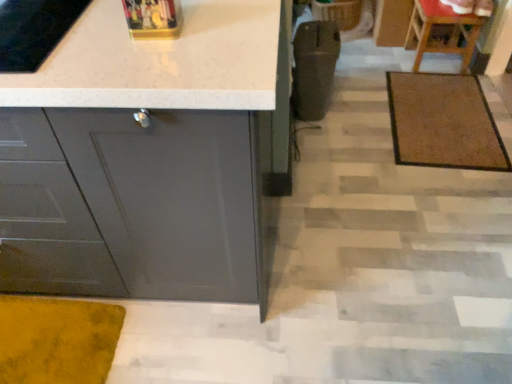
I want to click on brown textured mat at center right, so click(443, 122).

From the picture: Is matte gray cabinet at lower left situated inside wooden chair at upper right or outside?

matte gray cabinet at lower left is outside wooden chair at upper right.

From a real-world perspective, which object stands above the other?

In real-world perspective, matte gray cabinet at lower left is above.

From the image's perspective, is matte gray cabinet at lower left positioned above or below wooden chair at upper right?

Based on their image positions, matte gray cabinet at lower left is located beneath wooden chair at upper right.

Measure the distance between matte gray cabinet at lower left and wooden chair at upper right.

matte gray cabinet at lower left and wooden chair at upper right are 5.77 feet apart from each other.

From the image's perspective, between wooden chair at upper right and matte gray cabinet at lower left, which one is located above?

wooden chair at upper right, from the image's perspective.

From a real-world perspective, which is physically above, wooden chair at upper right or matte gray cabinet at lower left?

matte gray cabinet at lower left.

Is point (411, 23) positioned behind point (45, 171)?

Yes, point (411, 23) is behind point (45, 171).

Which is in front, point (444, 109) or point (428, 39)?

The point (444, 109) is more forward.

Can wooden chair at upper right be found inside brown textured mat at center right?

No, brown textured mat at center right does not contain wooden chair at upper right.

Is brown textured mat at center right taller or shorter than wooden chair at upper right?

Considering their sizes, brown textured mat at center right has less height than wooden chair at upper right.

From the image's perspective, which is above, brown textured mat at center right or wooden chair at upper right?

wooden chair at upper right, from the image's perspective.

Can you confirm if matte gray cabinet at lower left is wider than brown textured mat at center right?

In fact, matte gray cabinet at lower left might be narrower than brown textured mat at center right.

Based on the photo, is matte gray cabinet at lower left aimed at brown textured mat at center right?

No, matte gray cabinet at lower left is not facing towards brown textured mat at center right.

From a real-world perspective, between matte gray cabinet at lower left and brown textured mat at center right, who is vertically lower?

brown textured mat at center right, from a real-world perspective.

From the image's perspective, which object appears higher, matte gray cabinet at lower left or brown textured mat at center right?

brown textured mat at center right is shown above in the image.

Could you tell me if brown textured mat at center right is facing matte gray cabinet at lower left?

No, brown textured mat at center right is not oriented towards matte gray cabinet at lower left.

Does point (425, 162) come behind point (215, 181)?

Yes.

Between brown textured mat at center right and matte gray cabinet at lower left, which one has larger size?

matte gray cabinet at lower left is bigger.

Can you confirm if wooden chair at upper right is smaller than brown textured mat at center right?

No.

From the image's perspective, which is below, wooden chair at upper right or brown textured mat at center right?

brown textured mat at center right, from the image's perspective.

Can you confirm if wooden chair at upper right is taller than brown textured mat at center right?

Indeed, wooden chair at upper right has a greater height compared to brown textured mat at center right.

Image resolution: width=512 pixels, height=384 pixels. Find the location of `chair above the matte gray cabinet at lower left (from the image's perspective)`. chair above the matte gray cabinet at lower left (from the image's perspective) is located at coordinates (441, 32).

Image resolution: width=512 pixels, height=384 pixels. What are the coordinates of `cabinetry on the left of the wooden chair at upper right` in the screenshot? It's located at (149, 158).

Which object lies nearer to the anchor point matte gray cabinet at lower left, wooden chair at upper right or brown textured mat at center right?

Among the two, brown textured mat at center right is located nearer to matte gray cabinet at lower left.

Consider the image. Which object lies further to the anchor point brown textured mat at center right, wooden chair at upper right or matte gray cabinet at lower left?

Based on the image, matte gray cabinet at lower left appears to be further to brown textured mat at center right.

Based on their spatial positions, is brown textured mat at center right or matte gray cabinet at lower left further from wooden chair at upper right?

matte gray cabinet at lower left is further to wooden chair at upper right.

Estimate the real-world distances between objects in this image. Which object is closer to matte gray cabinet at lower left, brown textured mat at center right or wooden chair at upper right?

brown textured mat at center right is positioned closer to the anchor matte gray cabinet at lower left.

Estimate the real-world distances between objects in this image. Which object is closer to wooden chair at upper right, matte gray cabinet at lower left or brown textured mat at center right?

Based on the image, brown textured mat at center right appears to be nearer to wooden chair at upper right.

Estimate the real-world distances between objects in this image. Which object is closer to brown textured mat at center right, matte gray cabinet at lower left or wooden chair at upper right?

Based on the image, wooden chair at upper right appears to be nearer to brown textured mat at center right.

Find the location of `doormat located between matte gray cabinet at lower left and wooden chair at upper right in the left-right direction`. doormat located between matte gray cabinet at lower left and wooden chair at upper right in the left-right direction is located at coordinates (443, 122).